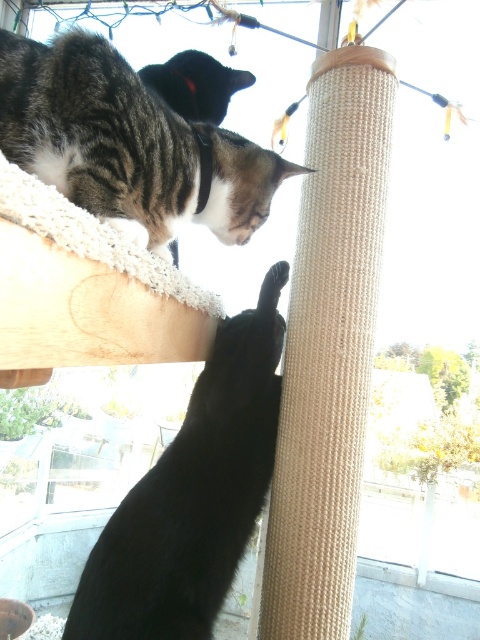
Question: Does black matte cat at upper left appear on the right side of tabby fur cat at upper left?

Choices:
 (A) no
 (B) yes

Answer: (B)

Question: Is black matte cat at upper left thinner than tabby fur cat at upper left?

Choices:
 (A) yes
 (B) no

Answer: (A)

Question: Which point appears farthest from the camera in this image?

Choices:
 (A) (165, 140)
 (B) (280, 378)

Answer: (B)

Question: Is black matte cat at upper left further to the viewer compared to tabby fur cat at upper left?

Choices:
 (A) no
 (B) yes

Answer: (B)